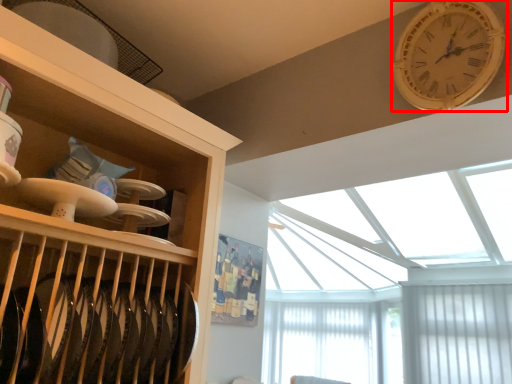
Question: From the image's perspective, what is the correct spatial positioning of wall clock (annotated by the red box) in reference to window screen?

Choices:
 (A) above
 (B) below

Answer: (A)